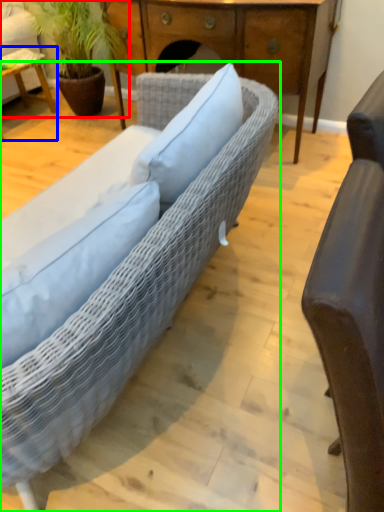
Question: Estimate the real-world distances between objects in this image. Which object is closer to houseplant (highlighted by a red box), table (highlighted by a blue box) or studio couch (highlighted by a green box)?

Choices:
 (A) table
 (B) studio couch

Answer: (A)